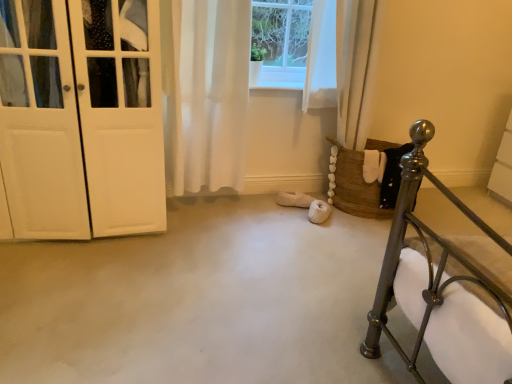
What are the coordinates of `free point below white sheer curtain at center (from a real-world perspective)` in the screenshot? It's located at (206, 207).